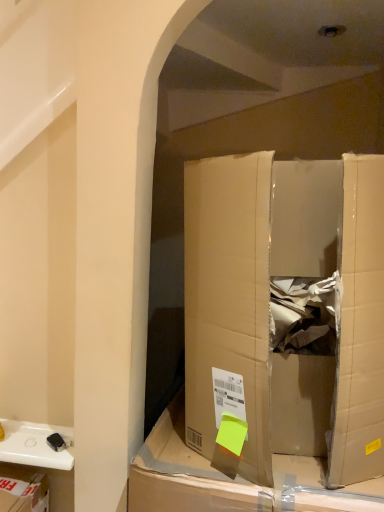
Identify the location of brown cardboard box at center. Image resolution: width=384 pixels, height=512 pixels. (285, 309).

What do you see at coordinates (285, 309) in the screenshot?
I see `brown cardboard box at center` at bounding box center [285, 309].

This screenshot has width=384, height=512. I want to click on brown cardboard box at center, so click(285, 309).